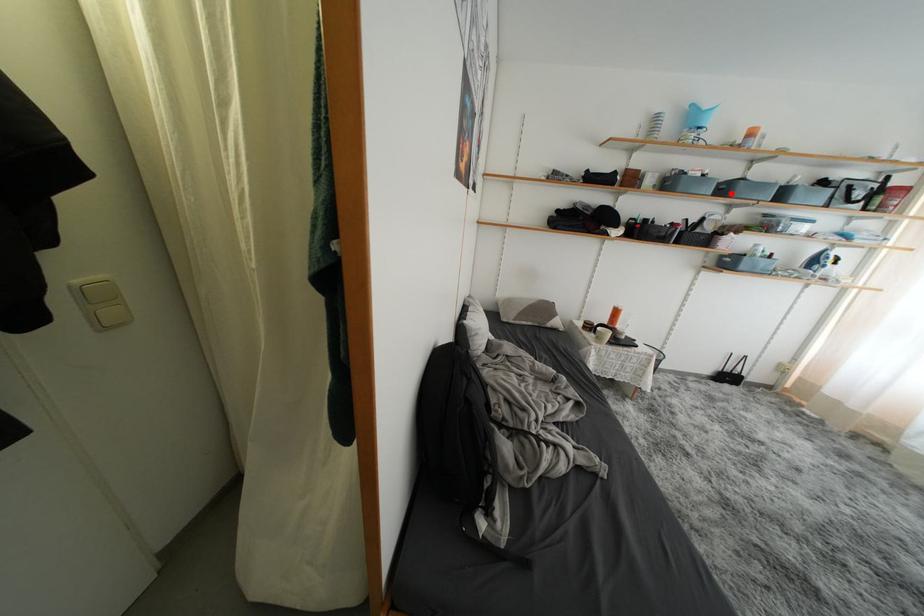
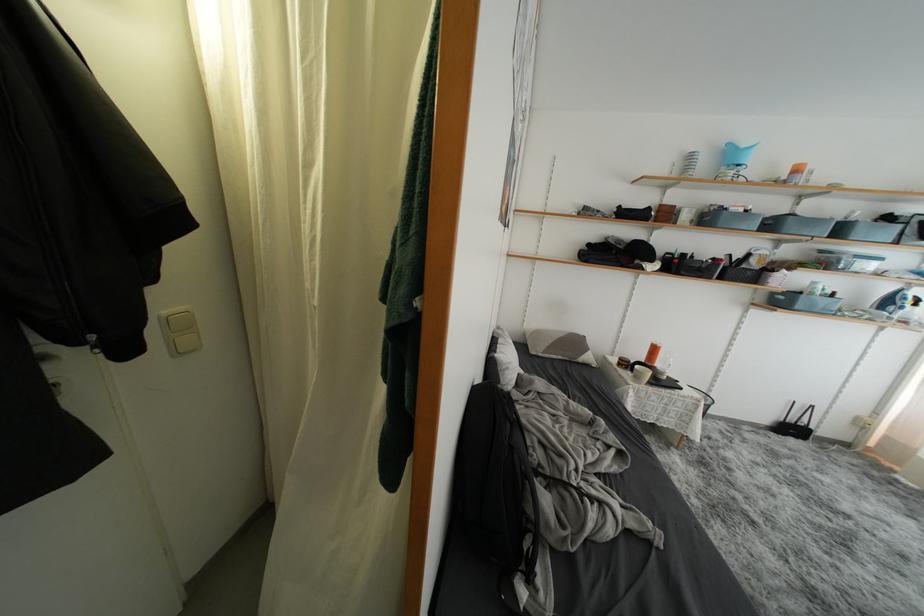
Find the pixel in the second image that matches the highlighted location in the first image.

(777, 229)